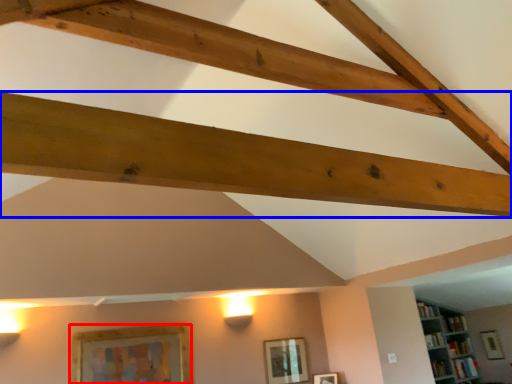
Question: Which of the following is the closest to the observer, picture frame (highlighted by a red box) or plank (highlighted by a blue box)?

Choices:
 (A) picture frame
 (B) plank

Answer: (B)